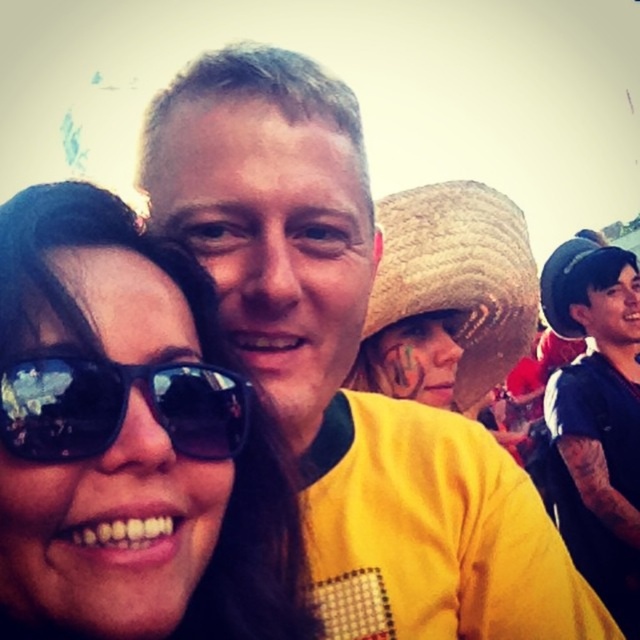
Question: Does dark blue t-shirt at right appear on the right side of black plastic sunglasses at lower left?

Choices:
 (A) yes
 (B) no

Answer: (A)

Question: Can you confirm if matte black sunglasses at center is positioned above dark blue t-shirt at right?

Choices:
 (A) yes
 (B) no

Answer: (A)

Question: Does woven straw hat at center have a greater width compared to black plastic sunglasses at lower left?

Choices:
 (A) no
 (B) yes

Answer: (A)

Question: Among these points, which one is nearest to the camera?

Choices:
 (A) (477, 390)
 (B) (253, 573)
 (C) (93, 436)
 (D) (595, 433)

Answer: (C)

Question: Which object is farther from the camera taking this photo?

Choices:
 (A) black plastic sunglasses at lower left
 (B) dark blue t-shirt at right
 (C) woven straw hat at center

Answer: (C)

Question: Among these objects, which one is nearest to the camera?

Choices:
 (A) woven straw hat at center
 (B) black plastic sunglasses at lower left
 (C) matte black sunglasses at center
 (D) dark blue t-shirt at right

Answer: (B)